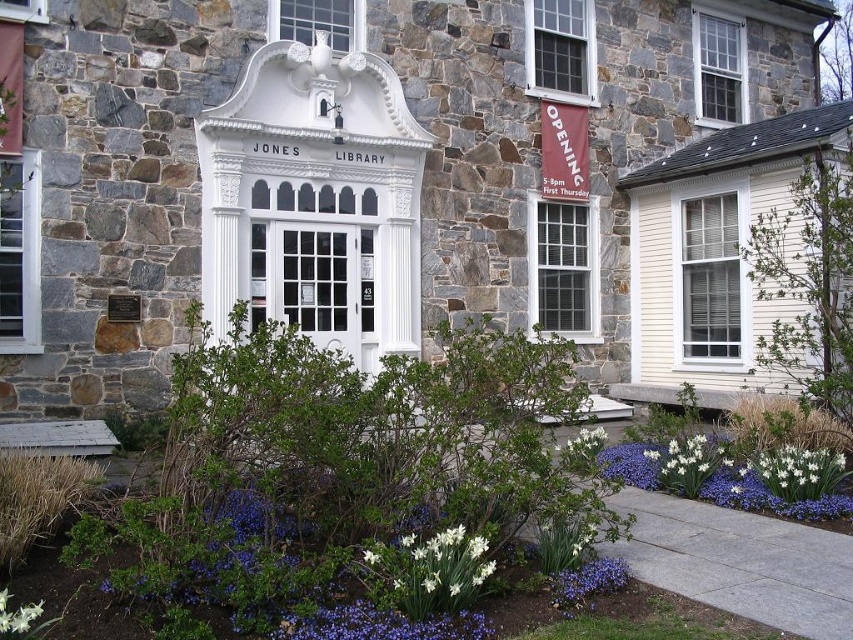
You are standing in front of the Jones Library and want to walk from the entrance to the garden. Which point, point (431, 540) or point (762, 476), is closer to you as you start walking towards the garden?

Point (431, 540) is closer to the viewer than point (762, 476), so it is the closer point as you start walking towards the garden.